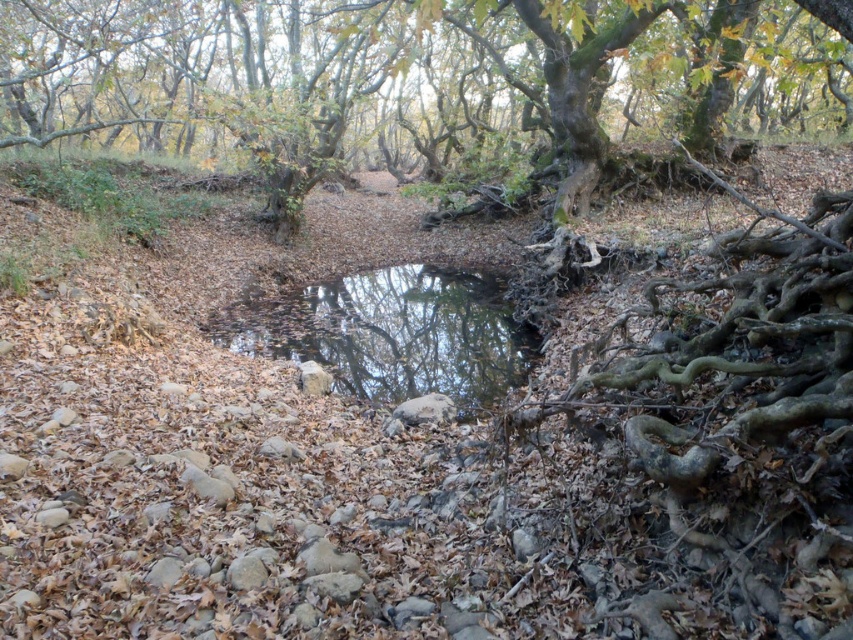
You are a hiker who has just arrived at the forest scene. You need to cross from the green mossy tree at center to the clear water at center. Given that your backpack has a weight limit of 20 kg, and you are carrying 18 kg already, can you safely make this journey if the path between them requires crossing a rocky terrain that adds 1 kg of extra weight due to the difficulty?

The distance between the green mossy tree at center and the clear water at center is 15.60 meters. Since the rocky terrain adds 1 kg to your load, your total weight would be 19 kg, which is under the 20 kg limit. Therefore, you can safely make the journey.

You are standing at the origin point in this forest scene. Where is the green mossy tree at center located in terms of its 2D coordinates?

The green mossy tree at center is located at the 2D coordinates of point (426, 88).